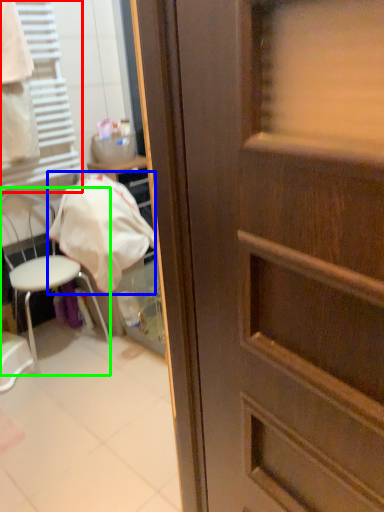
Question: Estimate the real-world distances between objects in this image. Which object is farther from shutter (highlighted by a red box), blanket (highlighted by a blue box) or chair (highlighted by a green box)?

Choices:
 (A) blanket
 (B) chair

Answer: (B)